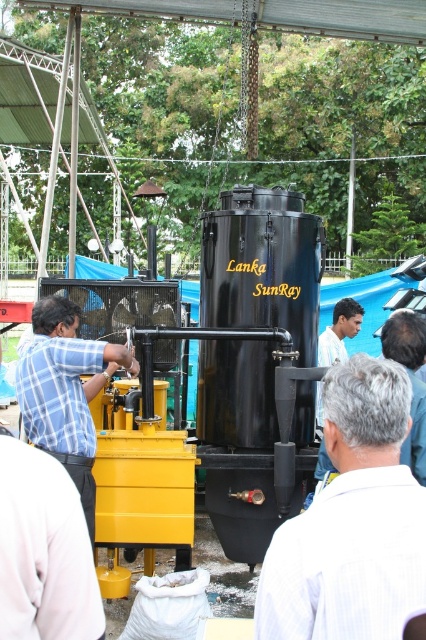
From the picture: Can you confirm if blue checkered shirt at left is taller than gray hair at upper right?

Correct, blue checkered shirt at left is much taller as gray hair at upper right.

Is point (62, 300) in front of point (419, 406)?

No, (62, 300) is behind (419, 406).

This screenshot has width=426, height=640. Find the location of `blue checkered shirt at left`. blue checkered shirt at left is located at coordinates (66, 390).

Which is behind, point (360, 589) or point (316, 419)?

Positioned behind is point (316, 419).

Is gray hair at center closer to the viewer compared to light blue shirt at center?

Yes, it is in front of light blue shirt at center.

Is point (331, 612) more distant than point (348, 333)?

No.

Find the location of a particular element. This screenshot has width=426, height=640. gray hair at center is located at coordinates (353, 522).

Can you confirm if blue checkered shirt at left is positioned to the left of light blue shirt at center?

Yes, blue checkered shirt at left is to the left of light blue shirt at center.

Does blue checkered shirt at left appear under light blue shirt at center?

Yes.

Is point (115, 346) behind point (316, 392)?

No, (115, 346) is closer to viewer.

Find the location of a particular element. blue checkered shirt at left is located at coordinates (66, 390).